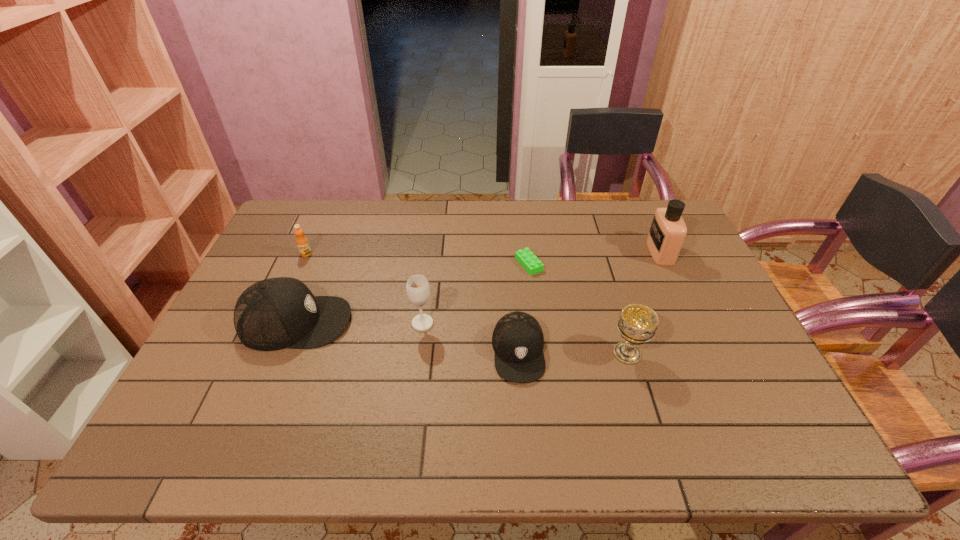
With all caps evenly spaced, where should an extra cap be placed on the right to continue the pattern? Please point out a vacant space. Please provide its 2D coordinates. Your answer should be formatted as a tuple, i.e. [(x, y)], where the tuple contains the x and y coordinates of a point satisfying the conditions above.

[(772, 384)]